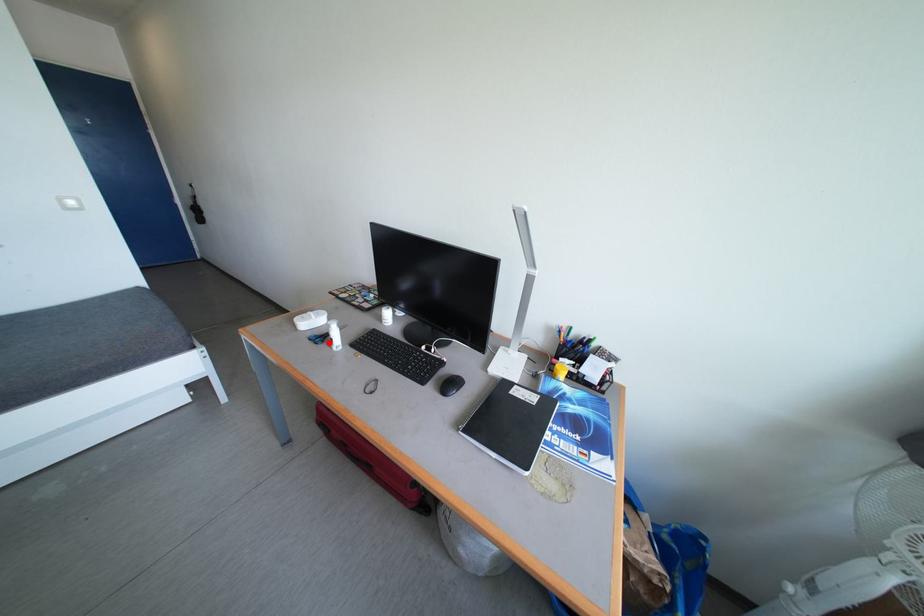
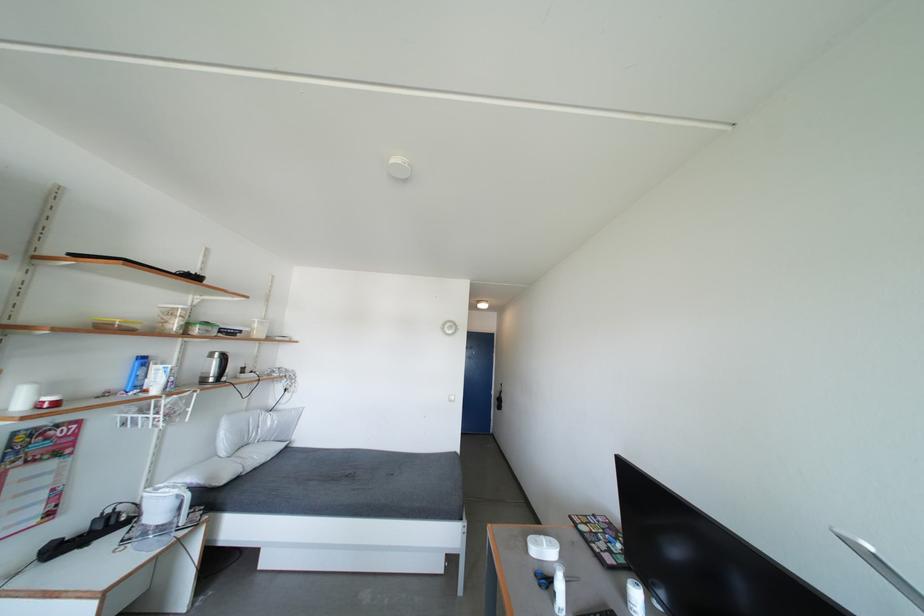
Question: I am providing you with two images of the same scene from different viewpoints. A red point is marked on the first image. Can you still see the location of the red point in image 2?

Choices:
 (A) Yes
 (B) No

Answer: (A)